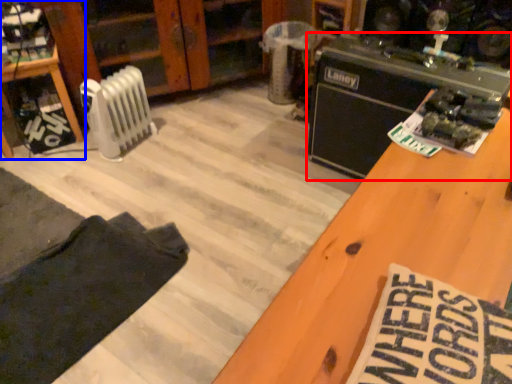
Question: Which object appears closest to the camera in this image, appliance (highlighted by a red box) or furniture (highlighted by a blue box)?

Choices:
 (A) appliance
 (B) furniture

Answer: (A)